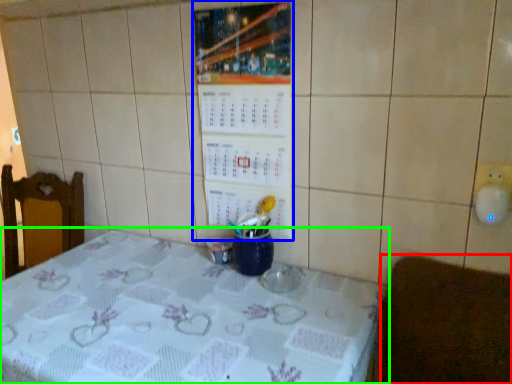
Question: Which is nearer to the furniture (highlighted by a red box)? bulletin board (highlighted by a blue box) or table (highlighted by a green box).

Choices:
 (A) bulletin board
 (B) table

Answer: (B)